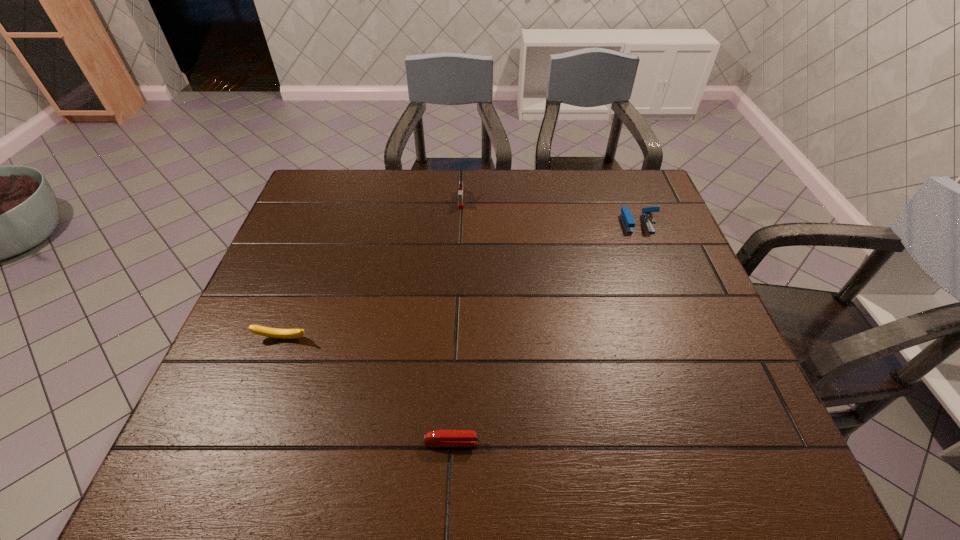
In the image, there is a desktop. Where is `free region at the near right corner`? The image size is (960, 540). free region at the near right corner is located at coordinates (711, 438).

At what (x,y) coordinates should I click in order to perform the action: click on free point between the shortest stapler and the farthest object. Please return your answer as a coordinate pair (x, y). The height and width of the screenshot is (540, 960). Looking at the image, I should click on (456, 320).

You are a GUI agent. You are given a task and a screenshot of the screen. Output one action in this format:
    pyautogui.click(x=<x>, y=<y>)
    Task: Click on the free space between the farthest object and the banana
    The width and height of the screenshot is (960, 540).
    Given the screenshot: What is the action you would take?
    pyautogui.click(x=372, y=268)

The height and width of the screenshot is (540, 960). In order to click on free space that is in between the third farthest object and the second tallest object in this screenshot , I will do `click(460, 281)`.

Find the location of a particular element. This screenshot has height=540, width=960. free point between the rightmost object and the banana is located at coordinates (460, 281).

Locate an element on the screen. free space between the third farthest object and the farthest stapler is located at coordinates pyautogui.click(x=372, y=268).

Locate an element on the screen. The height and width of the screenshot is (540, 960). empty space between the farthest object and the leftmost object is located at coordinates (372, 268).

Identify the location of free space between the nearest object and the farthest object. Image resolution: width=960 pixels, height=540 pixels. (456, 320).

The width and height of the screenshot is (960, 540). I want to click on vacant space that's between the second tallest stapler and the farthest stapler, so click(x=549, y=211).

The width and height of the screenshot is (960, 540). What are the coordinates of `free space between the banana and the third nearest object` in the screenshot? It's located at (x=460, y=281).